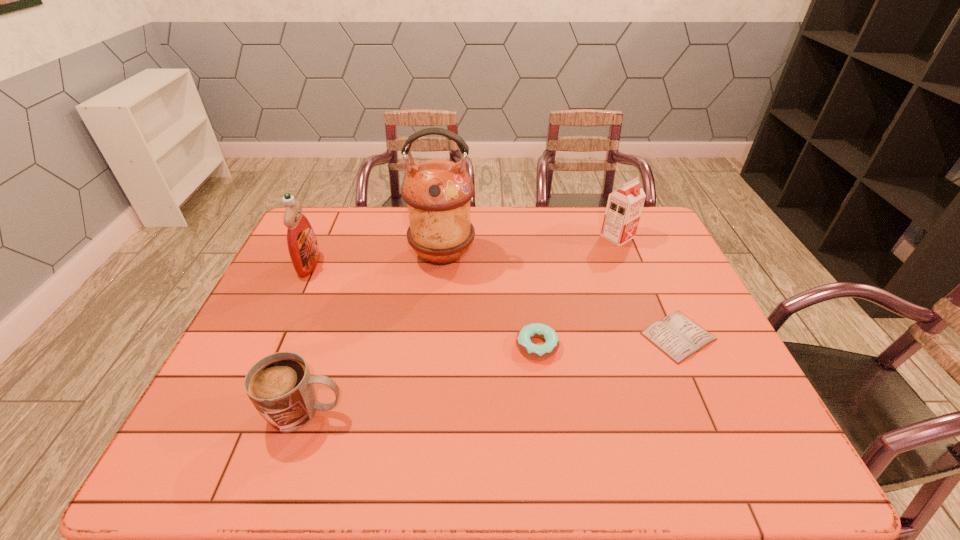
Where is `free area in between the shortest object and the doughnut`? free area in between the shortest object and the doughnut is located at coordinates (608, 341).

At what (x,y) coordinates should I click in order to perform the action: click on vacant space in between the second shortest object and the tallest object. Please return your answer as a coordinate pair (x, y). Looking at the image, I should click on (490, 301).

In order to click on vacant area that lies between the shortest object and the fourth shortest object in this screenshot , I will do `click(648, 286)`.

The width and height of the screenshot is (960, 540). Identify the location of free spot between the fourth tallest object and the fifth tallest object. (421, 379).

You are a GUI agent. You are given a task and a screenshot of the screen. Output one action in this format:
    pyautogui.click(x=<x>, y=<y>)
    Task: Click on the vacant space that is in between the fourth object from left to right and the oil lamp
    This screenshot has height=540, width=960.
    Given the screenshot: What is the action you would take?
    pyautogui.click(x=490, y=301)

Find the location of a particular element. The image size is (960, 540). vacant area between the mug and the oil lamp is located at coordinates (374, 334).

Where is `vacant point located between the shortest object and the tallest object`? The image size is (960, 540). vacant point located between the shortest object and the tallest object is located at coordinates (561, 296).

Identify the location of vacant area that lies between the leftmost object and the third object from left to right. Image resolution: width=960 pixels, height=540 pixels. (375, 260).

In order to click on vacant region between the fourth shortest object and the second shortest object in this screenshot , I will do `click(577, 291)`.

Locate an element on the screen. The height and width of the screenshot is (540, 960). object that is the second closest one to the fourth object from right to left is located at coordinates (302, 244).